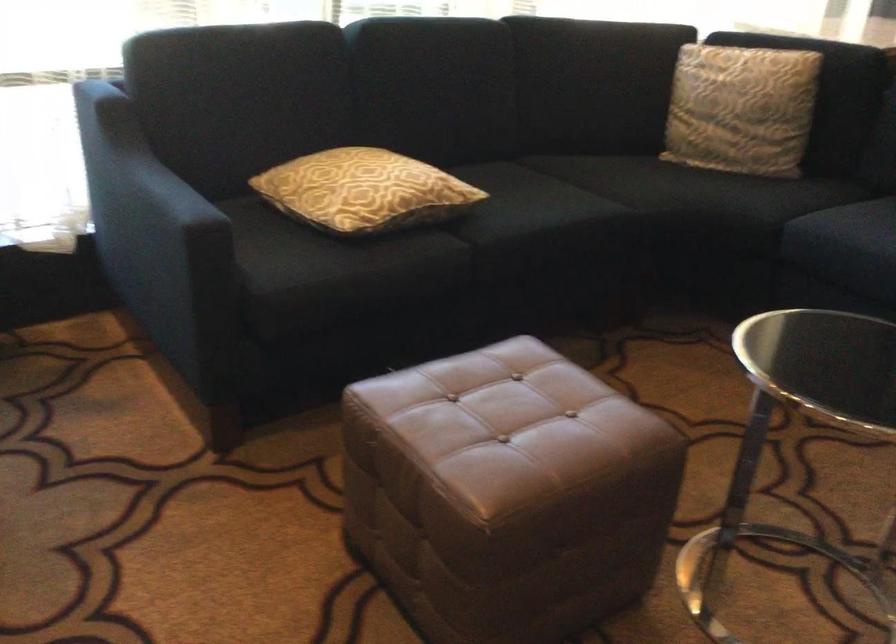
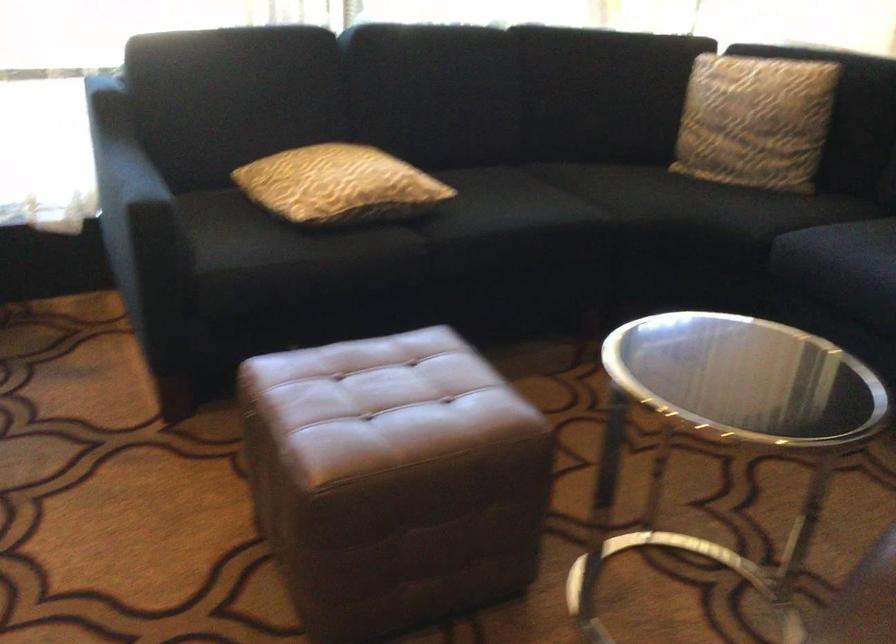
Where in the second image is the point corresponding to point 547,505 from the first image?

(392, 480)